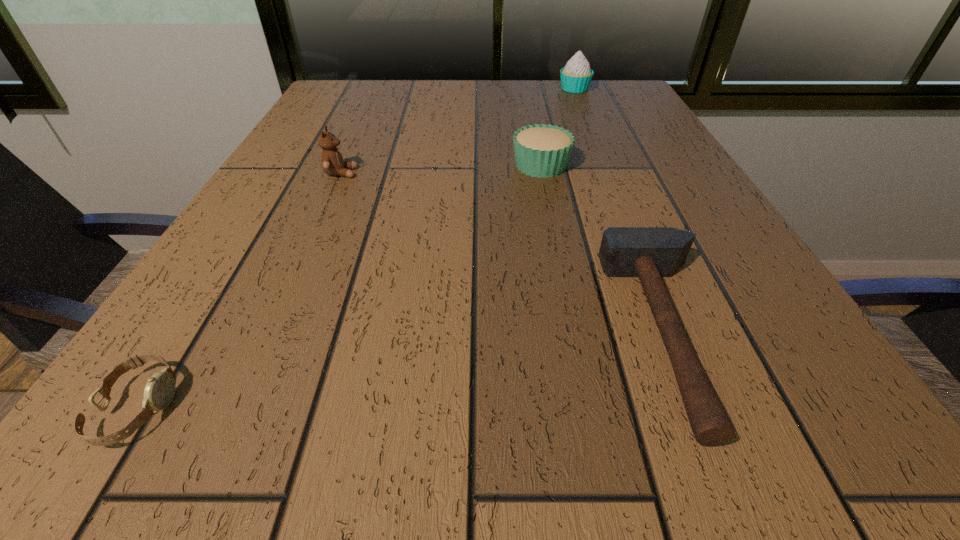
The image size is (960, 540). Find the location of `the taller cupcake`. the taller cupcake is located at coordinates (576, 76).

The width and height of the screenshot is (960, 540). Find the location of `the farther cupcake`. the farther cupcake is located at coordinates [576, 76].

In order to click on the fourth object from right to left in this screenshot , I will do `click(332, 161)`.

Find the location of `the left cupcake`. the left cupcake is located at coordinates (542, 150).

At what (x,y) coordinates should I click in order to perform the action: click on the shorter cupcake. Please return your answer as a coordinate pair (x, y). The width and height of the screenshot is (960, 540). Looking at the image, I should click on (542, 150).

Locate an element on the screen. the fourth tallest object is located at coordinates (650, 253).

Find the location of a particular element. Image resolution: width=960 pixels, height=540 pixels. the leftmost object is located at coordinates (159, 391).

Find the location of a particular element. The height and width of the screenshot is (540, 960). the shortest object is located at coordinates (159, 391).

What are the coordinates of `vacant space located on the front of the farther cupcake` in the screenshot? It's located at click(x=590, y=127).

At what (x,y) coordinates should I click in order to perform the action: click on vacant space located 0.060m on the front-facing side of the teddy bear. Please return your answer as a coordinate pair (x, y). The height and width of the screenshot is (540, 960). Looking at the image, I should click on (390, 173).